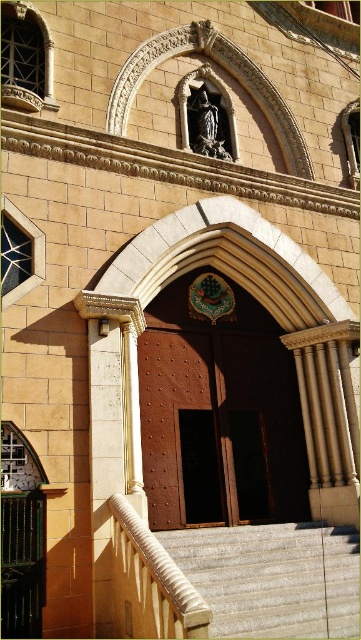
Is point (197, 442) positioned after point (281, 618)?

Yes, point (197, 442) is farther from viewer.

Is point (266, 484) closer to camera compared to point (348, 568)?

No, it is behind (348, 568).

Where is `brown polished wood door at center`? The image size is (361, 640). brown polished wood door at center is located at coordinates (219, 416).

Does light gray concrete stairs at lower center appear on the right side of brown wooden door at center?

Indeed, light gray concrete stairs at lower center is positioned on the right side of brown wooden door at center.

Is point (284, 586) closer to viewer compared to point (189, 518)?

That is True.

Measure the distance between light gray concrete stairs at lower center and camera.

A distance of 21.07 meters exists between light gray concrete stairs at lower center and camera.

Image resolution: width=361 pixels, height=640 pixels. Identify the location of light gray concrete stairs at lower center. (272, 577).

Who is positioned more to the right, brown polished wood door at center or brown wooden door at center?

Positioned to the right is brown polished wood door at center.

Does point (199, 472) come closer to viewer compared to point (225, 522)?

No, (199, 472) is further to viewer.

The image size is (361, 640). I want to click on brown polished wood door at center, so click(x=219, y=416).